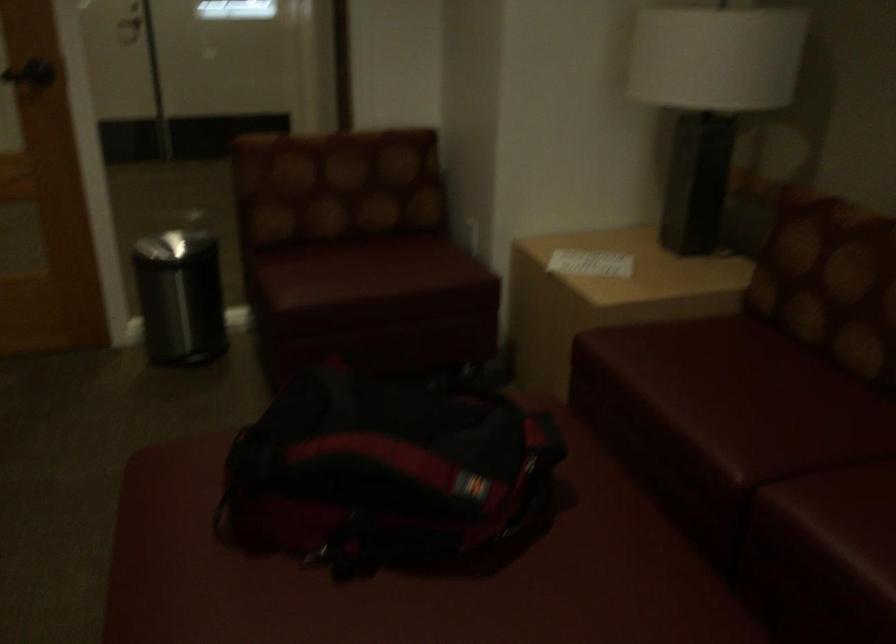
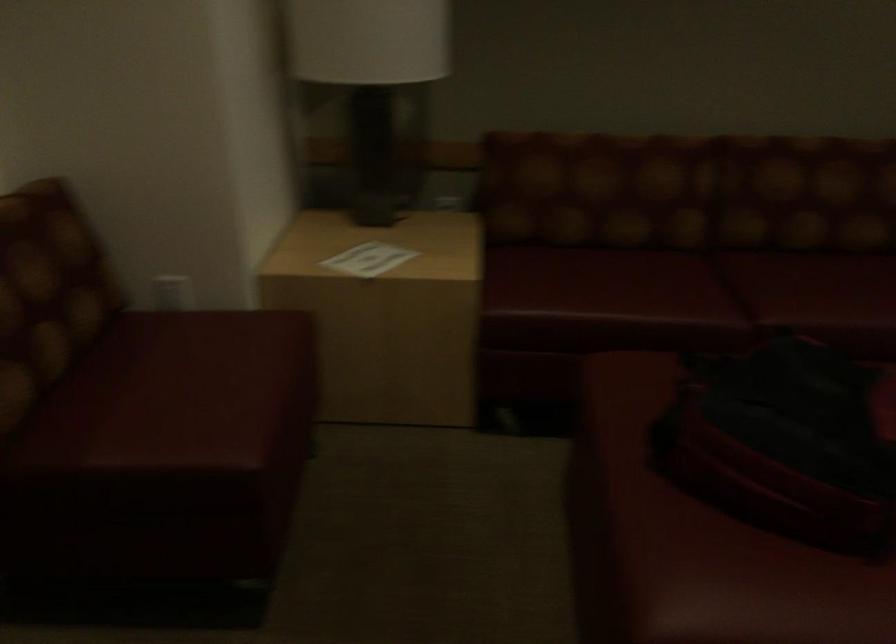
Locate, in the second image, the point that corresponds to (x=247, y=457) in the first image.

(693, 541)